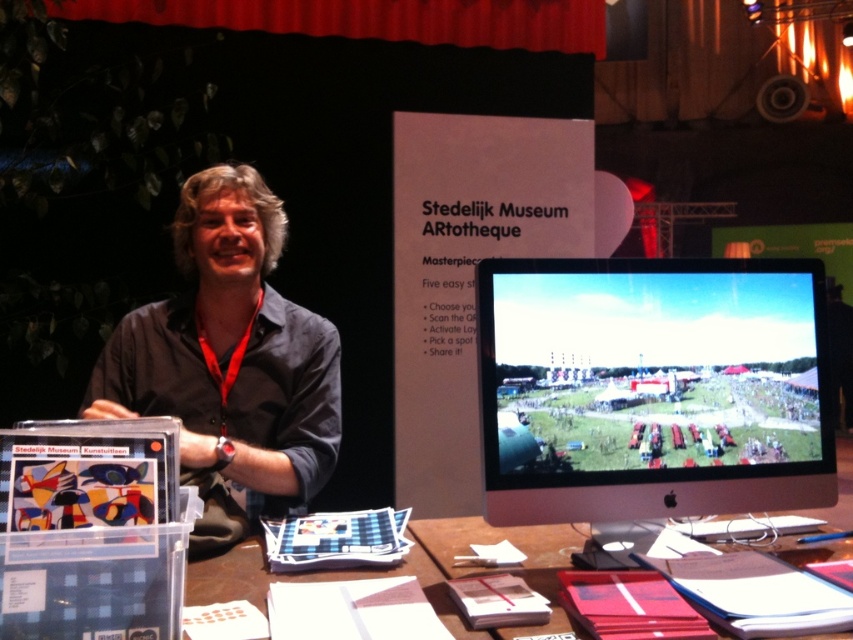
Question: Does satin black monitor at center have a larger size compared to dark blue shirt at center?

Choices:
 (A) no
 (B) yes

Answer: (A)

Question: Considering the real-world distances, which object is closest to the satin black monitor at center?

Choices:
 (A) brown paper at center
 (B) dark blue shirt at center

Answer: (A)

Question: Which object appears closest to the camera in this image?

Choices:
 (A) brown paper at center
 (B) satin black monitor at center
 (C) dark blue shirt at center

Answer: (A)

Question: Estimate the real-world distances between objects in this image. Which object is farther from the brown paper at center?

Choices:
 (A) satin black monitor at center
 (B) dark blue shirt at center

Answer: (B)

Question: Can you confirm if satin black monitor at center is smaller than dark blue shirt at center?

Choices:
 (A) yes
 (B) no

Answer: (A)

Question: Does satin black monitor at center appear on the left side of brown paper at center?

Choices:
 (A) no
 (B) yes

Answer: (A)